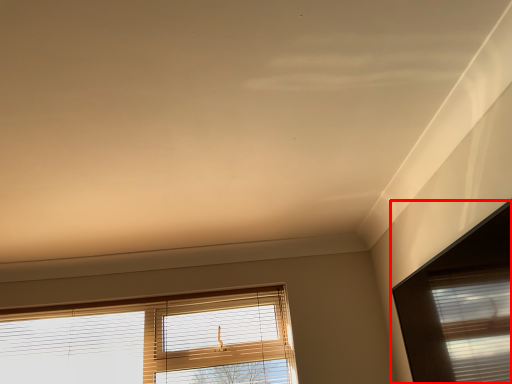
Question: From the image, what is the correct spatial relationship of window (annotated by the red box) in relation to window?

Choices:
 (A) left
 (B) right

Answer: (B)